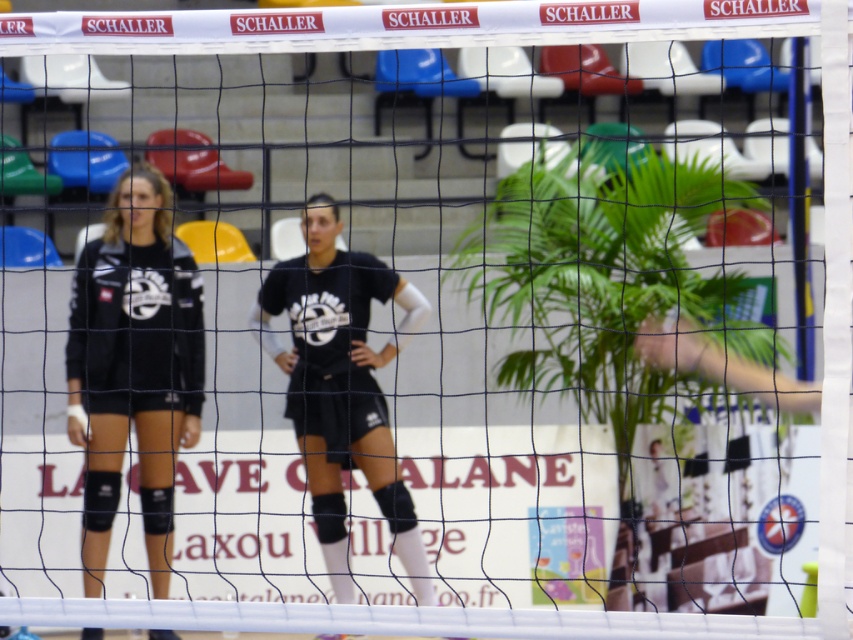
Is black matte uniform at center above matte black uniform at center?

Yes, black matte uniform at center is above matte black uniform at center.

Is black matte uniform at center wider than matte black uniform at center?

No, black matte uniform at center is not wider than matte black uniform at center.

Describe the element at coordinates (132, 365) in the screenshot. I see `black matte uniform at center` at that location.

In order to click on black matte uniform at center in this screenshot , I will do `click(132, 365)`.